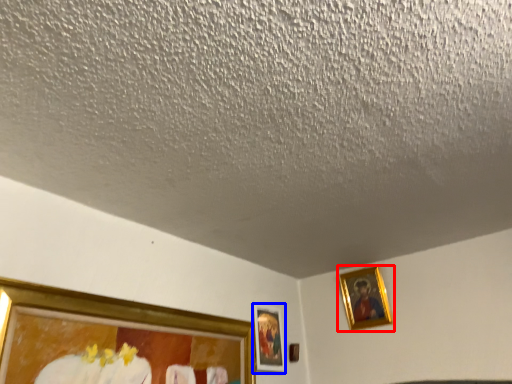
Question: Which object appears farthest to the camera in this image, picture frame (highlighted by a red box) or picture frame (highlighted by a blue box)?

Choices:
 (A) picture frame
 (B) picture frame

Answer: (A)